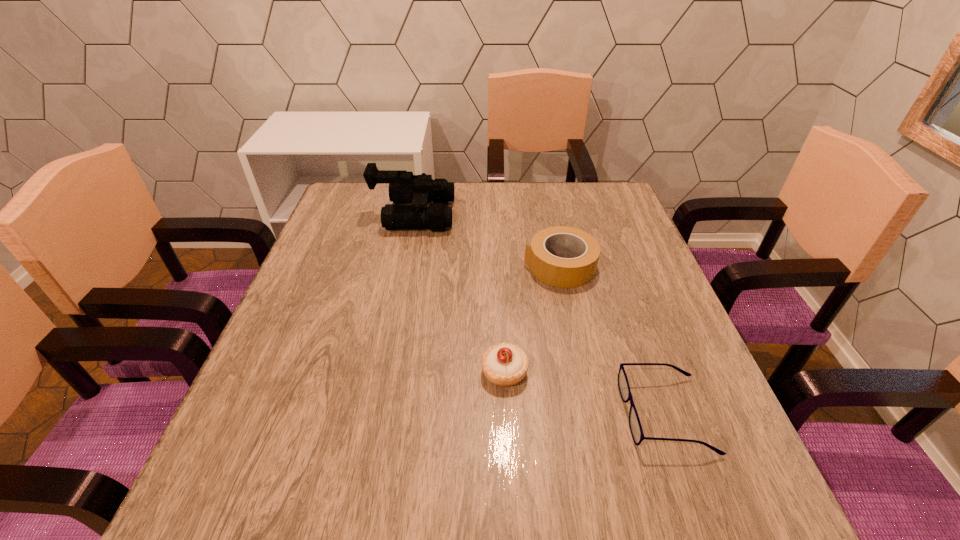
The width and height of the screenshot is (960, 540). In order to click on free space between the leftmost object and the pastry in this screenshot , I will do `click(459, 293)`.

Find the location of a particular element. The width and height of the screenshot is (960, 540). free point between the tallest object and the spectacles is located at coordinates point(540,314).

This screenshot has width=960, height=540. In order to click on vacant area that lies between the leftmost object and the spectacles in this screenshot , I will do `click(540, 314)`.

What are the coordinates of `free spot between the second object from left to right and the third nearest object` in the screenshot? It's located at (532, 319).

Where is `free spot between the leftmost object and the third nearest object`? The height and width of the screenshot is (540, 960). free spot between the leftmost object and the third nearest object is located at coordinates (487, 240).

Find the location of a particular element. The height and width of the screenshot is (540, 960). object identified as the closest to the binoculars is located at coordinates (560, 272).

Locate which object ranks in proximity to the third object from right to left. Please provide its 2D coordinates. Your answer should be formatted as a tuple, i.e. [(x, y)], where the tuple contains the x and y coordinates of a point satisfying the conditions above.

[(635, 426)]

Find the location of `vacant region that satisfies the following two spatial constraints: 1. on the front lenses of the pastry; 2. on the right side of the tallest object`. vacant region that satisfies the following two spatial constraints: 1. on the front lenses of the pastry; 2. on the right side of the tallest object is located at coordinates (381, 372).

Where is `vacant area in the image that satisfies the following two spatial constraints: 1. on the back side of the second object from left to right; 2. on the front lenses of the binoculars`? This screenshot has width=960, height=540. vacant area in the image that satisfies the following two spatial constraints: 1. on the back side of the second object from left to right; 2. on the front lenses of the binoculars is located at coordinates (496, 214).

Locate an element on the screen. blank area in the image that satisfies the following two spatial constraints: 1. on the front lenses of the farthest object; 2. on the left side of the second object from left to right is located at coordinates click(381, 372).